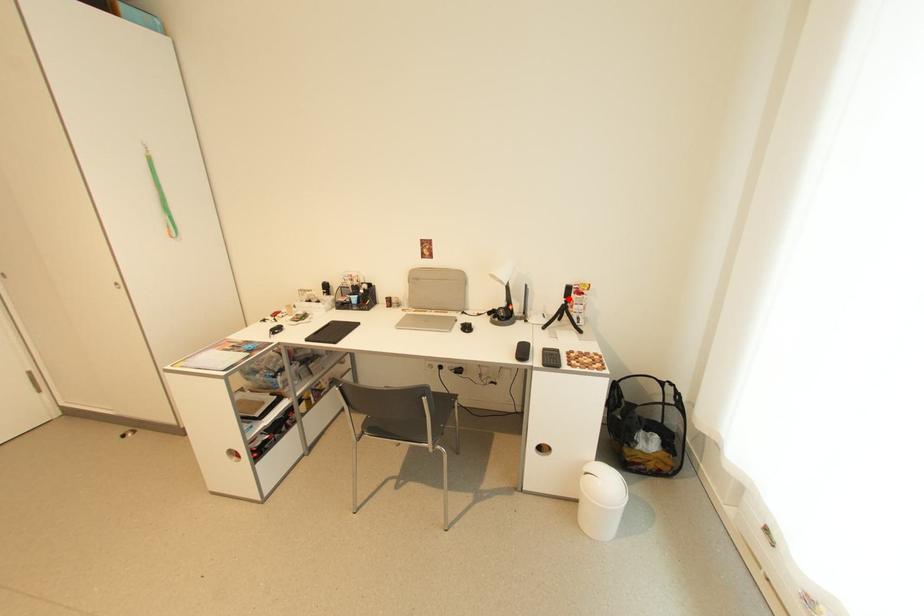
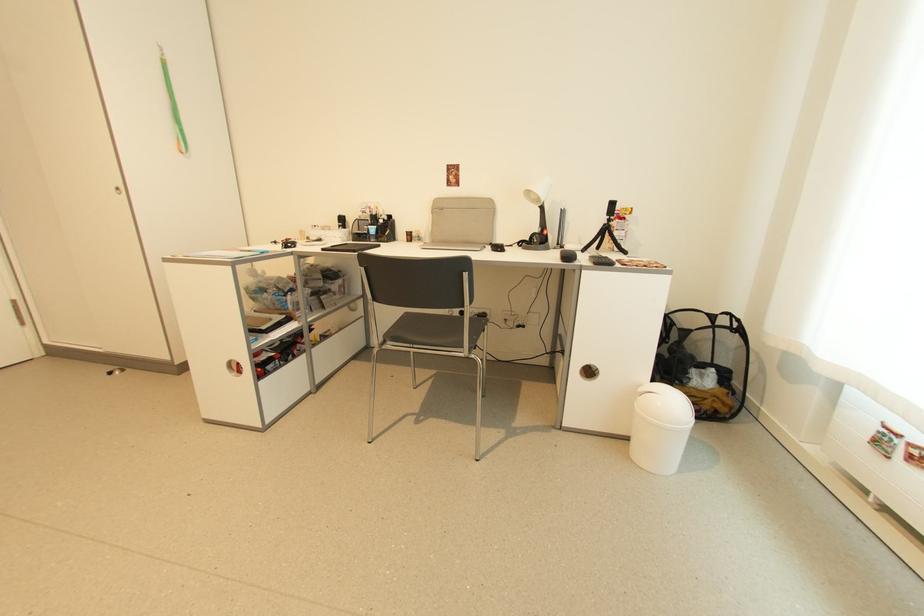
Locate, in the second image, the point that corresponds to the highlighted location in the first image.

(612, 217)